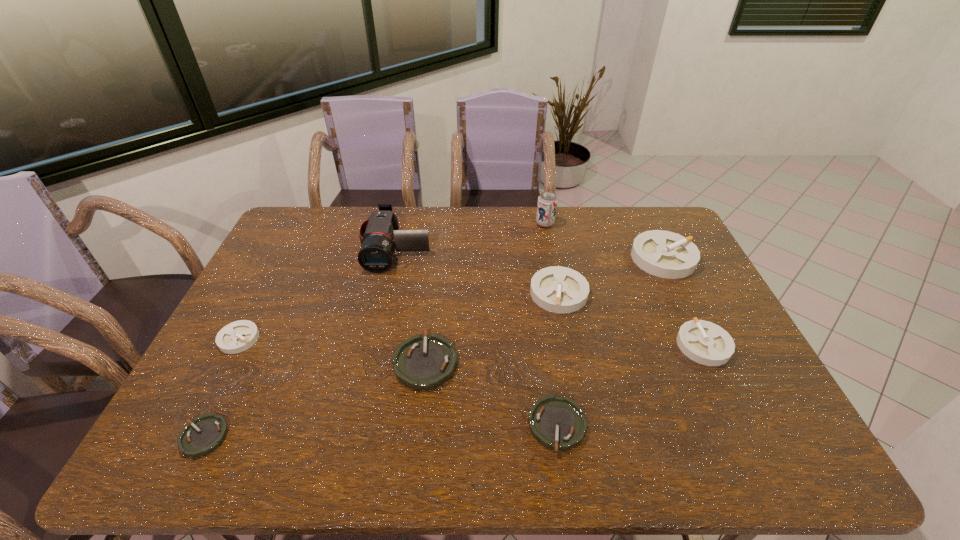
Find the location of a particular element. This screenshot has height=540, width=960. vacant space at the left edge of the desktop is located at coordinates (293, 248).

The height and width of the screenshot is (540, 960). What are the coordinates of `free space that is in between the smallest gray ashtray and the camcorder` in the screenshot? It's located at (318, 293).

Identify the location of vacant area that lies between the leftmost green ashtray and the camcorder. (300, 342).

The height and width of the screenshot is (540, 960). I want to click on empty space that is in between the rightmost green ashtray and the biggest gray ashtray, so click(611, 342).

The image size is (960, 540). I want to click on empty space between the second green ashtray from right to left and the second smallest green ashtray, so [x=492, y=394].

At what (x,y) coordinates should I click in order to perform the action: click on vacant area that lies between the third biggest gray ashtray and the beer can. Please return your answer as a coordinate pair (x, y). Image resolution: width=960 pixels, height=540 pixels. Looking at the image, I should click on (624, 285).

Where is `free spot between the beer can and the fifth shortest object`? free spot between the beer can and the fifth shortest object is located at coordinates (624, 285).

Where is `free point between the leftmost gray ashtray and the beer can`? free point between the leftmost gray ashtray and the beer can is located at coordinates (392, 281).

Locate an element on the screen. The image size is (960, 540). vacant area between the leftmost green ashtray and the rightmost green ashtray is located at coordinates click(x=381, y=431).

You are a GUI agent. You are given a task and a screenshot of the screen. Output one action in this format:
    pyautogui.click(x=<x>, y=<y>)
    Task: Click on the free space between the fifth tallest object and the beer can
    
    Given the screenshot: What is the action you would take?
    pyautogui.click(x=624, y=285)